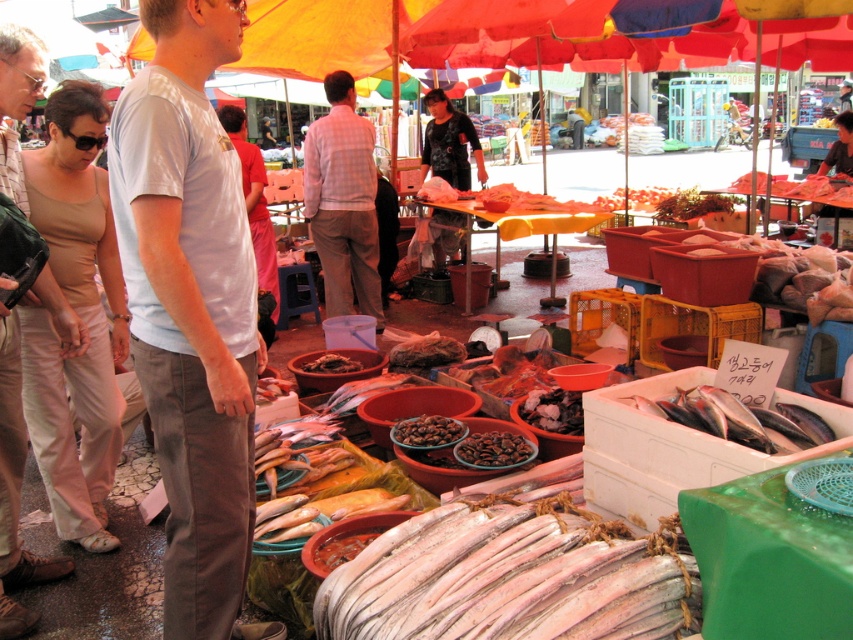
Is brown textured fish at center shorter than brown matte beans at center?

Result: No.

Which is above, brown textured fish at center or brown matte beans at center?

brown textured fish at center

Between point (434, 340) and point (415, 428), which one is positioned behind?

The point (434, 340) is more distant.

Where is `brown textured fish at center`? The image size is (853, 640). brown textured fish at center is located at coordinates (426, 352).

Between light blue cotton shirt at center and brown matte beans at center, which one is positioned higher?

light blue cotton shirt at center

Is light blue cotton shirt at center taller than brown matte beans at center?

Indeed, light blue cotton shirt at center has a greater height compared to brown matte beans at center.

Does point (199, 38) come behind point (421, 445)?

No.

At what (x,y) coordinates should I click in order to perform the action: click on light blue cotton shirt at center. Please return your answer as a coordinate pair (x, y). The image size is (853, 640). Looking at the image, I should click on (190, 307).

In the scene shown: Is brown matte beans at center below brown matte dried fish at center?

Indeed, brown matte beans at center is positioned under brown matte dried fish at center.

Can you confirm if brown matte beans at center is thinner than brown matte dried fish at center?

Indeed, brown matte beans at center has a lesser width compared to brown matte dried fish at center.

Who is more forward, (424,417) or (318,369)?

Positioned in front is point (424,417).

Where is `brown matte beans at center`? The width and height of the screenshot is (853, 640). brown matte beans at center is located at coordinates tap(427, 432).